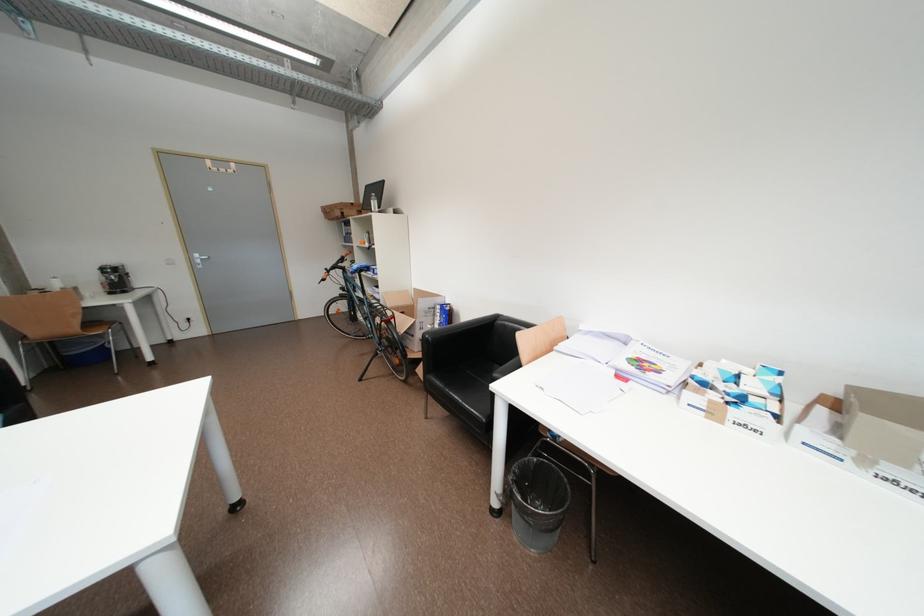
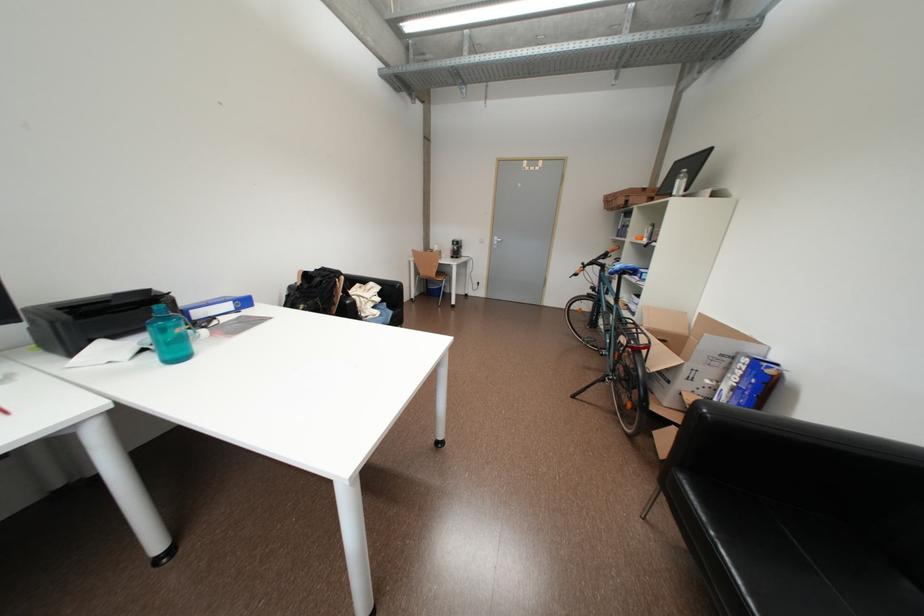
The point at (362, 269) is marked in the first image. Where is the corresponding point in the second image?

(626, 268)